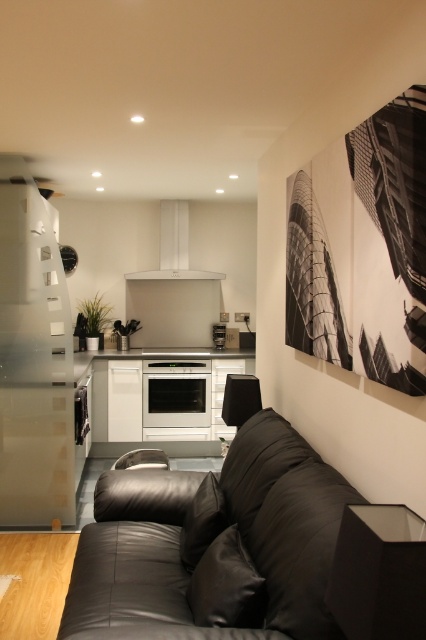
Locate an element on the screen. The width and height of the screenshot is (426, 640). white glossy exhaust hood at center is located at coordinates (173, 246).

From the picture: Is white glossy exhaust hood at center further to the viewer compared to white glossy oven at center?

No, it is not.

Does point (178, 240) come in front of point (224, 339)?

Yes.

I want to click on white glossy exhaust hood at center, so (x=173, y=246).

Can you confirm if satin silver oven at center is thinner than white glossy exhaust hood at center?

Indeed, satin silver oven at center has a lesser width compared to white glossy exhaust hood at center.

Who is positioned more to the left, satin silver oven at center or white glossy exhaust hood at center?

Positioned to the left is satin silver oven at center.

Is point (152, 387) closer to camera compared to point (161, 275)?

Yes, it is in front of point (161, 275).

This screenshot has width=426, height=640. Find the location of `satin silver oven at center`. satin silver oven at center is located at coordinates (175, 394).

Is black leather couch at lower center taller than matte black side table at lower right?

Yes.

Who is taller, black leather couch at lower center or matte black side table at lower right?

black leather couch at lower center is taller.

Does point (259, 586) lie behind point (376, 621)?

That is True.

Image resolution: width=426 pixels, height=640 pixels. What are the coordinates of `black leather couch at lower center` in the screenshot? It's located at (213, 547).